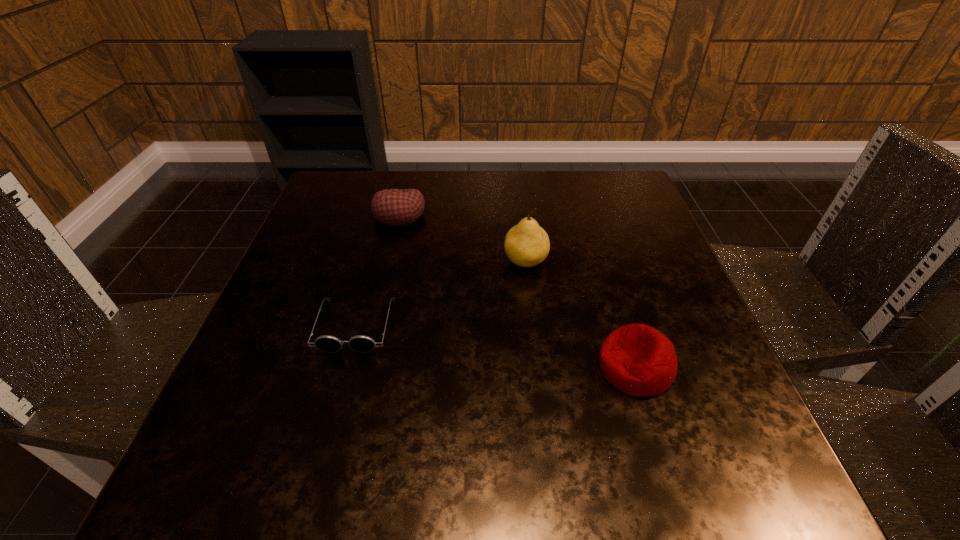
This screenshot has height=540, width=960. Identify the location of the third nearest object. (526, 244).

At what (x,y) coordinates should I click in order to perform the action: click on the third object from left to right. Please return your answer as a coordinate pair (x, y). Looking at the image, I should click on (526, 244).

Where is `the left beanbag`? The image size is (960, 540). the left beanbag is located at coordinates (396, 207).

Find the location of a particular element. The image size is (960, 540). the farther beanbag is located at coordinates (396, 207).

At what (x,y) coordinates should I click in order to perform the action: click on the right beanbag. Please return your answer as a coordinate pair (x, y). Looking at the image, I should click on (637, 359).

You are a GUI agent. You are given a task and a screenshot of the screen. Output one action in this format:
    pyautogui.click(x=<x>, y=<y>)
    Task: Click on the rightmost object
    
    Given the screenshot: What is the action you would take?
    pyautogui.click(x=637, y=359)

Identify the location of the shortest object. This screenshot has height=540, width=960. (360, 343).

Locate an element on the screen. The width and height of the screenshot is (960, 540). vacant region located on the right of the pear is located at coordinates (668, 261).

Image resolution: width=960 pixels, height=540 pixels. In order to click on free space located on the back of the farther beanbag in this screenshot , I will do `click(410, 172)`.

You are a GUI agent. You are given a task and a screenshot of the screen. Output one action in this format:
    pyautogui.click(x=<x>, y=<y>)
    Task: Click on the free space located 0.330m on the seat area of the right beanbag
    
    Given the screenshot: What is the action you would take?
    pos(396,367)